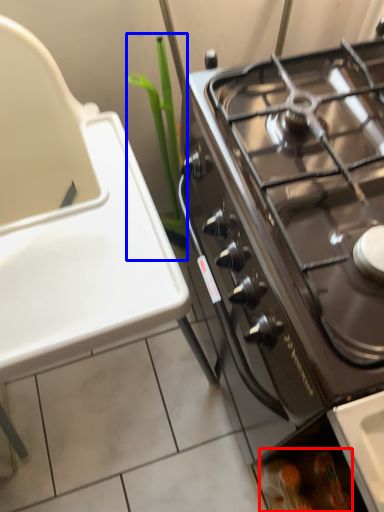
Question: Among these objects, which one is farthest to the camera, food (highlighted by a red box) or plant (highlighted by a blue box)?

Choices:
 (A) food
 (B) plant

Answer: (A)